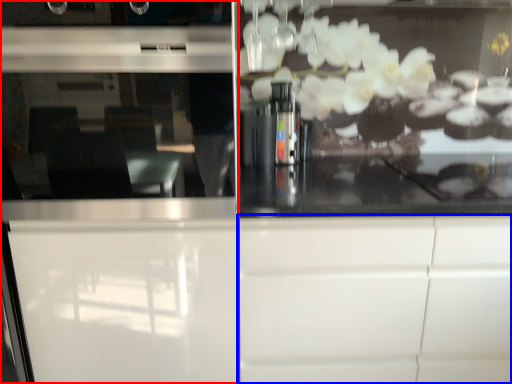
Question: Which object is further to the camera taking this photo, screen door (highlighted by a red box) or cabinetry (highlighted by a blue box)?

Choices:
 (A) screen door
 (B) cabinetry

Answer: (B)